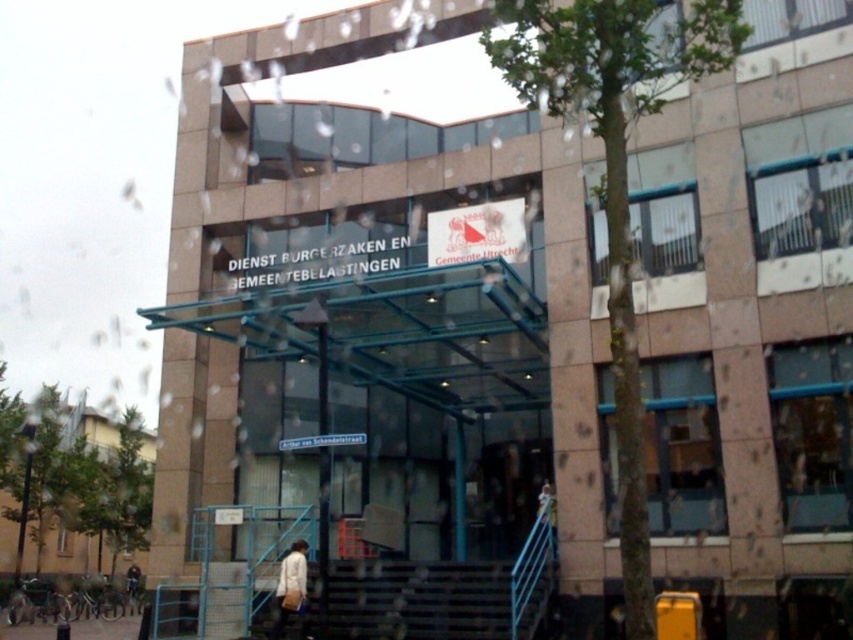
Based on the photo, who is shorter, metallic gray stairs at lower center or white fabric bag at lower center?

Standing shorter between the two is metallic gray stairs at lower center.

Is point (340, 608) more distant than point (277, 628)?

Yes, it is behind point (277, 628).

Find the location of `metallic gray stairs at lower center`. metallic gray stairs at lower center is located at coordinates (413, 600).

Does white fabric bag at lower center have a lesser width compared to light brown leather jacket at lower center?

No, white fabric bag at lower center is not thinner than light brown leather jacket at lower center.

This screenshot has width=853, height=640. Describe the element at coordinates (291, 588) in the screenshot. I see `white fabric bag at lower center` at that location.

Which is in front, point (294, 541) or point (537, 500)?

Positioned in front is point (294, 541).

Find the location of a particular element. The width and height of the screenshot is (853, 640). white fabric bag at lower center is located at coordinates (291, 588).

Does metallic gray stairs at lower center have a smaller size compared to light brown leather jacket at lower center?

Actually, metallic gray stairs at lower center might be larger than light brown leather jacket at lower center.

I want to click on metallic gray stairs at lower center, so click(x=413, y=600).

Does point (384, 624) lie in front of point (537, 496)?

Yes.

The width and height of the screenshot is (853, 640). Identify the location of metallic gray stairs at lower center. (413, 600).